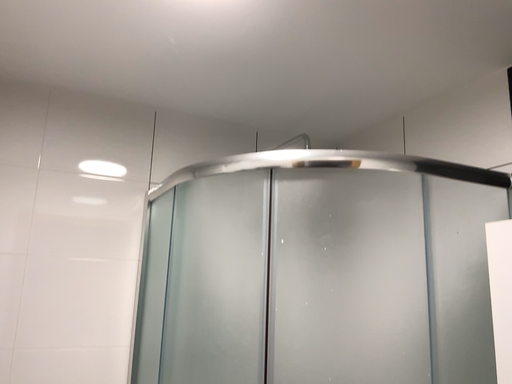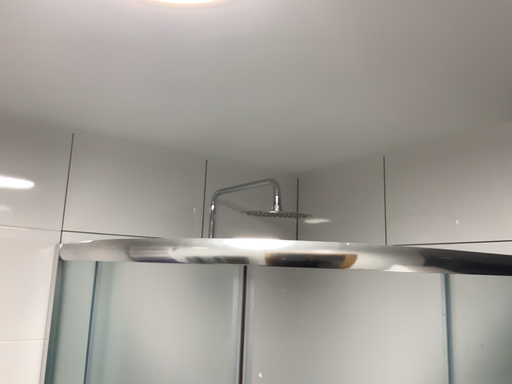
Question: Which way did the camera rotate in the video?

Choices:
 (A) rotated right
 (B) rotated left

Answer: (A)